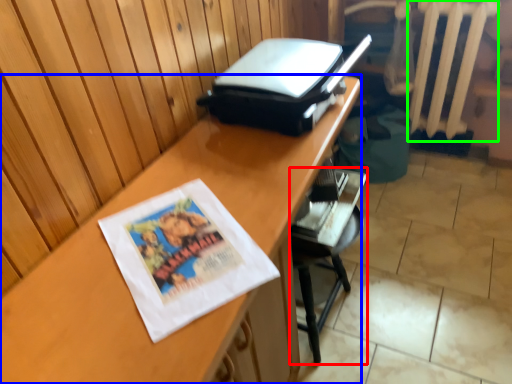
Question: Based on their relative distances, which object is farther from furniture (highlighted by a red box)? Choose from desk (highlighted by a blue box) and radiator (highlighted by a green box).

Choices:
 (A) desk
 (B) radiator

Answer: (B)